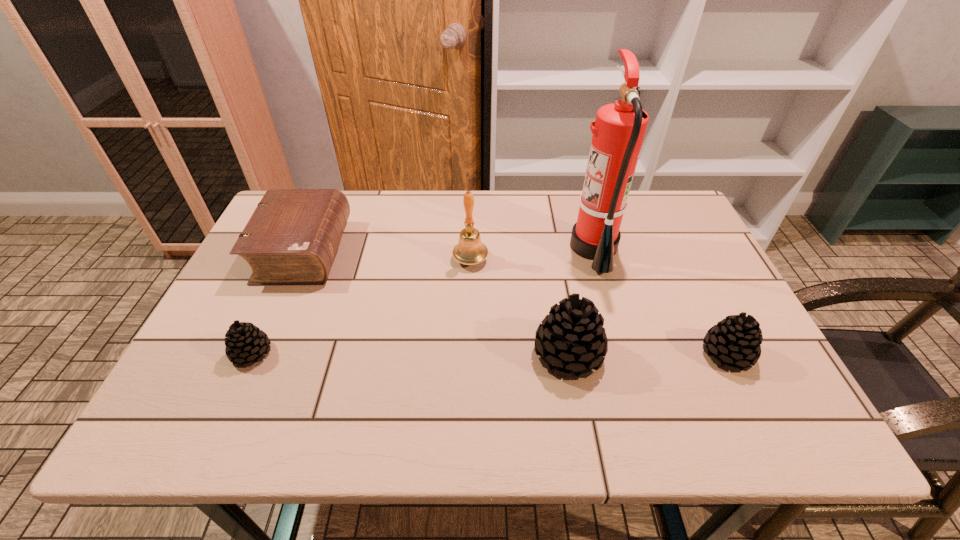
Where is `the shortest pinecone`? The image size is (960, 540). the shortest pinecone is located at coordinates (245, 342).

In order to click on the leftmost pinecone in this screenshot , I will do `click(245, 342)`.

Locate an element on the screen. This screenshot has width=960, height=540. the second pinecone from right to left is located at coordinates (572, 338).

Find the location of a particular element. The width and height of the screenshot is (960, 540). the third tallest object is located at coordinates (572, 338).

The height and width of the screenshot is (540, 960). I want to click on the rightmost pinecone, so click(735, 341).

The width and height of the screenshot is (960, 540). I want to click on the second tallest pinecone, so click(735, 341).

I want to click on fire extinguisher, so click(619, 129).

Locate an element on the screen. This screenshot has width=960, height=540. Bible is located at coordinates (292, 237).

In order to click on the fourth object from right to left in this screenshot , I will do `click(470, 250)`.

The image size is (960, 540). In order to click on the fifth shortest object in this screenshot , I will do `click(470, 250)`.